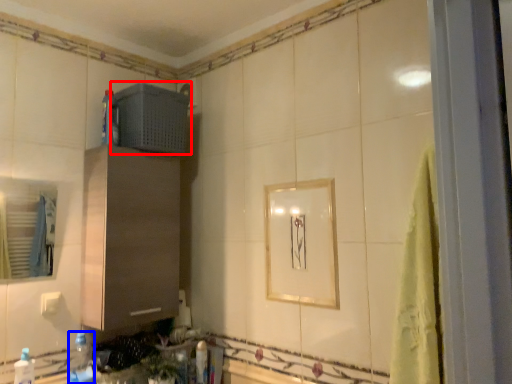
Question: Which object is closer to the camera taking this photo, appliance (highlighted by a red box) or bottle (highlighted by a blue box)?

Choices:
 (A) appliance
 (B) bottle

Answer: (B)